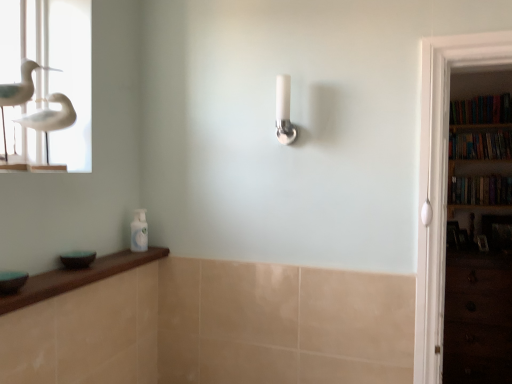
Question: Is white glossy shower head at center to the left or to the right of hardcover books at right, the 3th book ordered from the bottom, in the image?

Choices:
 (A) right
 (B) left

Answer: (B)

Question: Looking at the image, does white glossy shower head at center seem bigger or smaller compared to hardcover books at right, the 3th book ordered from the bottom?

Choices:
 (A) small
 (B) big

Answer: (A)

Question: Which is nearer to the dark wood drawer at lower right?

Choices:
 (A) hardcover books at right, the 3th book ordered from the bottom
 (B) hardcover books at right, which appears as the second book when ordered from the bottom
 (C) wooden bookshelf at right, which is the 3th book from top to bottom
 (D) white matte bird at upper left
 (E) white glossy shower head at center

Answer: (C)

Question: Considering the real-world distances, which object is farthest from the dark wood drawer at lower right?

Choices:
 (A) white matte bird at upper left
 (B) hardcover books at right, marked as the 1th book in a top-to-bottom arrangement
 (C) hardcover books at right, the second book from the top
 (D) wooden bookshelf at right, marked as the 1th book in a bottom-to-top arrangement
 (E) white glossy shower head at center

Answer: (A)